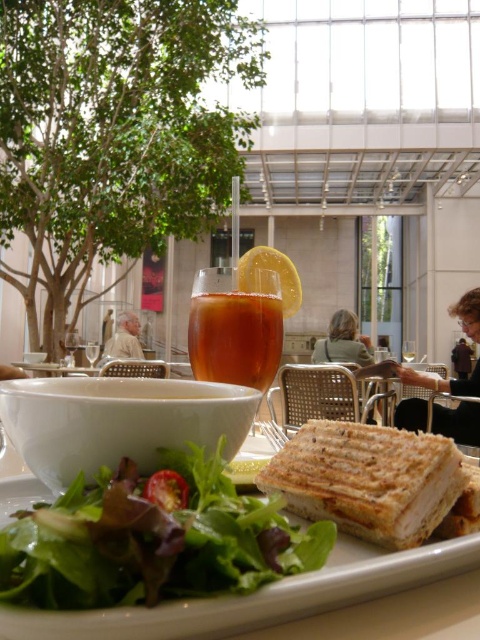
Can you confirm if golden brown toasted sandwich at center is positioned above matte white shirt at center?

Indeed, golden brown toasted sandwich at center is positioned over matte white shirt at center.

Is golden brown toasted sandwich at center wider than matte white shirt at center?

No.

Where is `golden brown toasted sandwich at center`? This screenshot has height=640, width=480. golden brown toasted sandwich at center is located at coordinates (368, 480).

The image size is (480, 640). What are the coordinates of `golden brown toasted sandwich at center` in the screenshot? It's located at (368, 480).

Is matte brown hair at right positioned behind brown toasted sandwich at center?

Yes, matte brown hair at right is further from the viewer.

Does point (444, 426) come behind point (475, 467)?

Yes, it is behind point (475, 467).

This screenshot has height=640, width=480. In order to click on matte brown hair at right in this screenshot , I will do `click(457, 422)`.

Who is lower down, golden brown toasted sandwich at center or brown toasted sandwich at center?

Positioned lower is brown toasted sandwich at center.

Is golden brown toasted sandwich at center above brown toasted sandwich at center?

Yes, golden brown toasted sandwich at center is above brown toasted sandwich at center.

Find the location of a particular element. golden brown toasted sandwich at center is located at coordinates (368, 480).